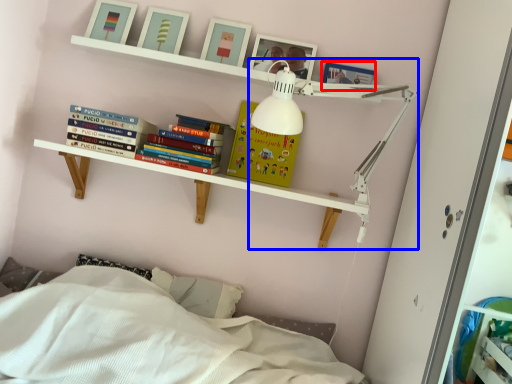
Question: Which of the following is the closest to the observer, picture frame (highlighted by a red box) or lamp (highlighted by a blue box)?

Choices:
 (A) picture frame
 (B) lamp

Answer: (B)